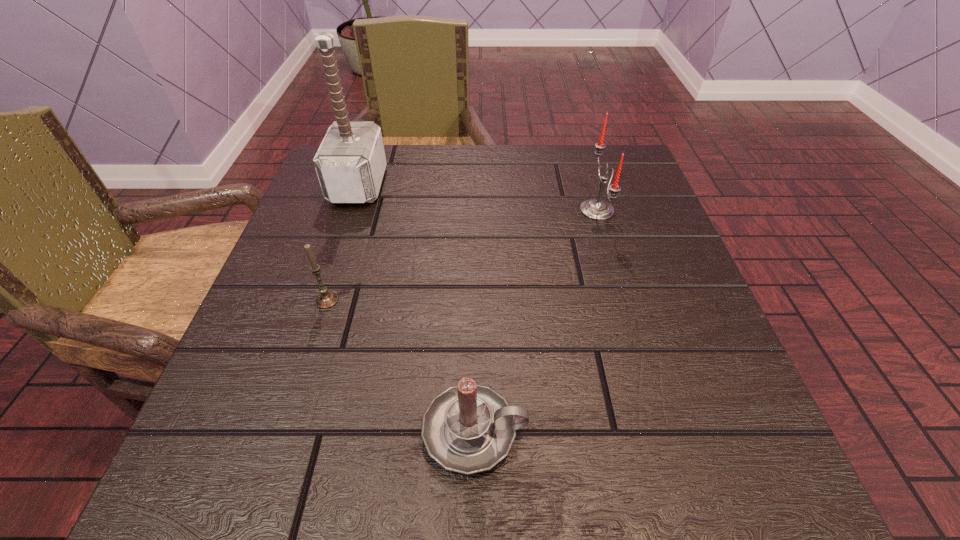
Locate an element on the screen. object located at the far right corner is located at coordinates (596, 209).

This screenshot has height=540, width=960. What are the coordinates of `vacant space at the far edge of the desktop` in the screenshot? It's located at (525, 181).

Identify the location of vacant space at the near edge of the desktop. (360, 459).

Image resolution: width=960 pixels, height=540 pixels. Identify the location of vacant space at the left edge. (321, 241).

Find the location of a particular element. vacant space at the right edge is located at coordinates (691, 364).

At what (x,y) coordinates should I click in order to perform the action: click on vacant space at the far left corner. Please return your answer as a coordinate pair (x, y). This screenshot has width=960, height=540. Looking at the image, I should click on (358, 204).

In the image, there is a desktop. Identify the location of vacant space at the near left corner. (195, 461).

This screenshot has width=960, height=540. I want to click on vacant space at the far right corner of the desktop, so click(x=612, y=148).

The height and width of the screenshot is (540, 960). In the image, there is a desktop. Identify the location of free space at the near right corner. (652, 444).

At what (x,y) coordinates should I click in order to perform the action: click on free spot between the second candle from right to left and the farthest candle. Please return your answer as a coordinate pair (x, y). Looking at the image, I should click on (536, 321).